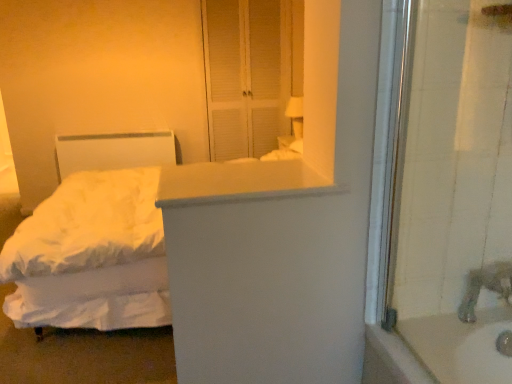
Question: From the image's perspective, is silver metallic faucet at lower right positioned above or below white soft bed at left?

Choices:
 (A) below
 (B) above

Answer: (A)

Question: From a real-world perspective, relative to white soft bed at left, is silver metallic faucet at lower right vertically above or below?

Choices:
 (A) below
 (B) above

Answer: (B)

Question: Estimate the real-world distances between objects in this image. Which object is farther from the silver metallic faucet at lower right?

Choices:
 (A) white soft bed at left
 (B) white matte counter top at center
 (C) white matte screen door at upper center

Answer: (C)

Question: Which object is the farthest from the white matte counter top at center?

Choices:
 (A) white soft bed at left
 (B) white matte screen door at upper center
 (C) silver metallic faucet at lower right

Answer: (B)